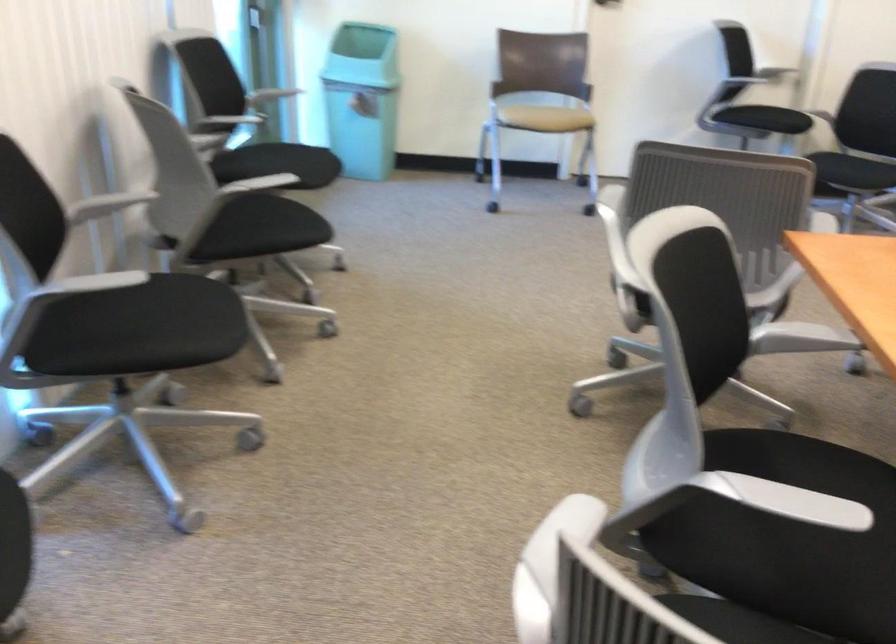
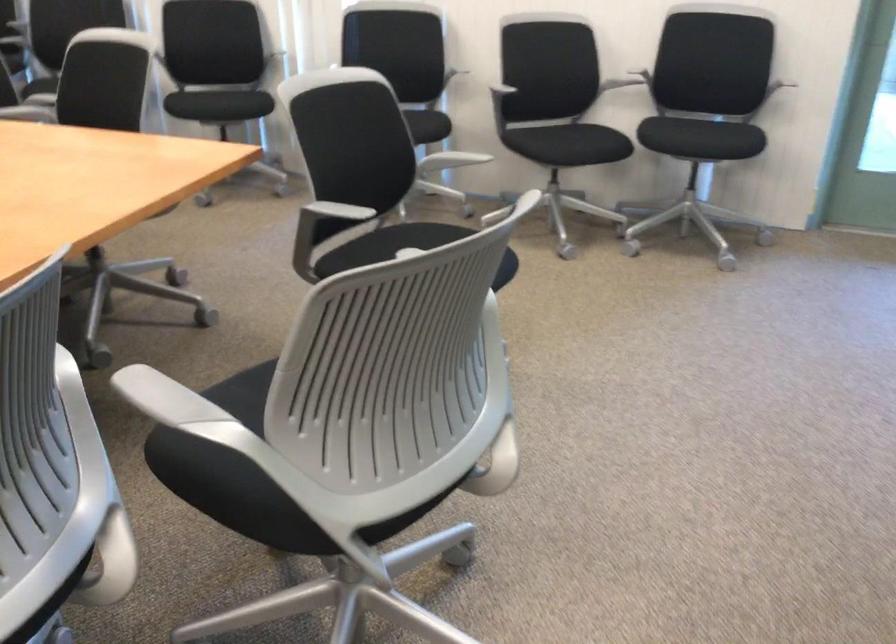
The point at (170,221) is marked in the first image. Where is the corresponding point in the second image?

(510, 96)